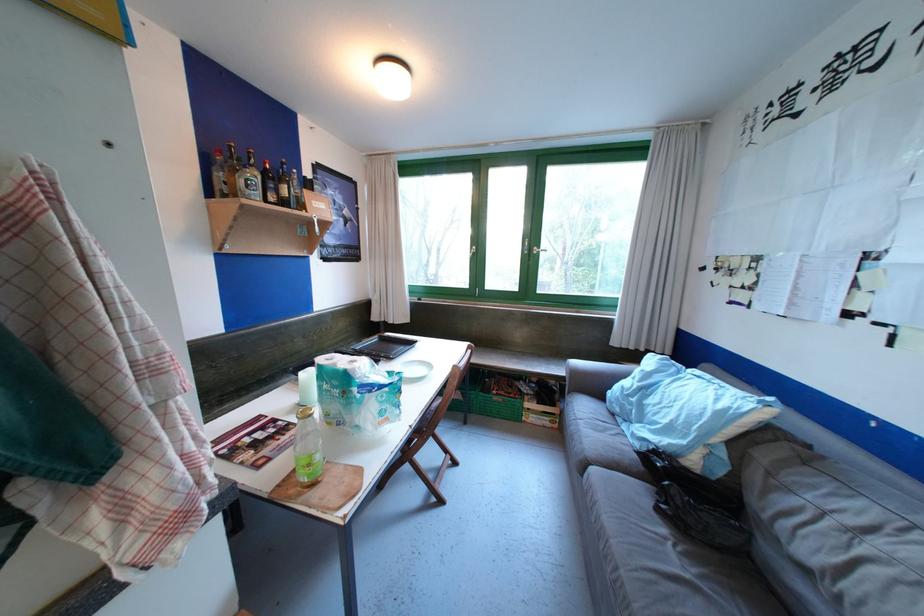
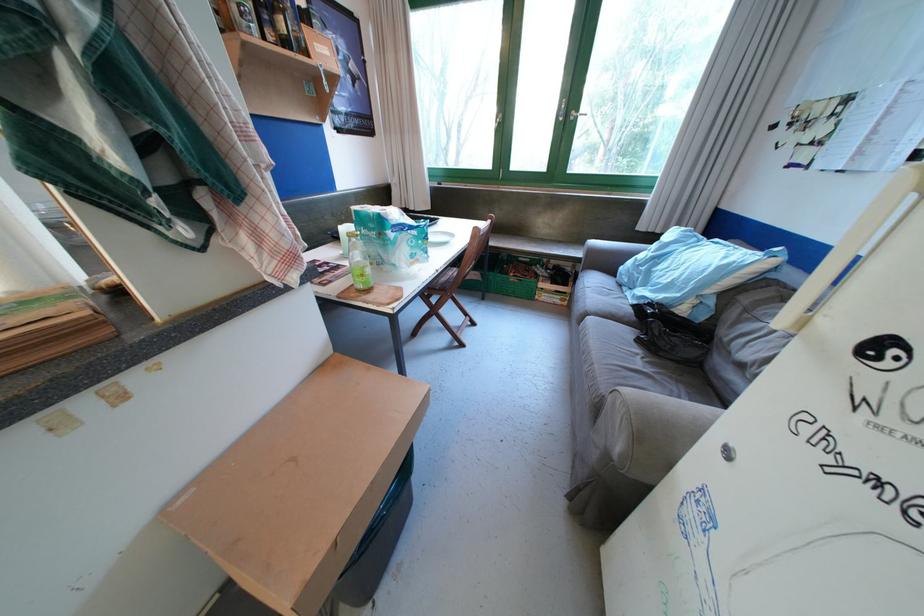
Question: The first image is from the beginning of the video and the second image is from the end. How did the camera likely rotate when shooting the video?

Choices:
 (A) Left
 (B) Right
 (C) Up
 (D) Down

Answer: (D)